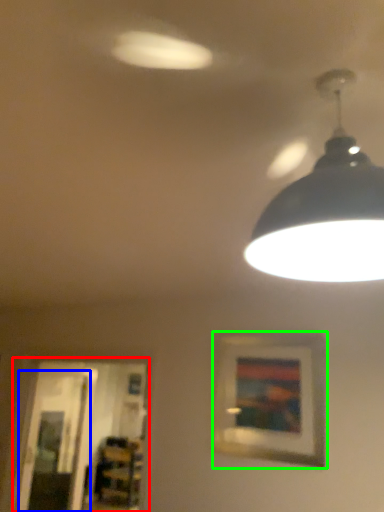
Question: Based on their relative distances, which object is farther from glass door (highlighted by a red box)? Choose from glass door (highlighted by a blue box) and picture frame (highlighted by a green box).

Choices:
 (A) glass door
 (B) picture frame

Answer: (B)